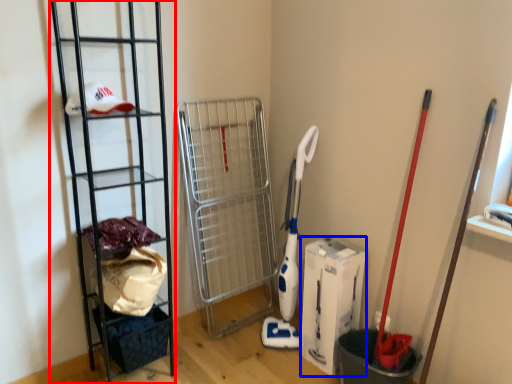
Question: Which object appears farthest to the camera in this image, ladder (highlighted by a red box) or box (highlighted by a blue box)?

Choices:
 (A) ladder
 (B) box

Answer: (B)